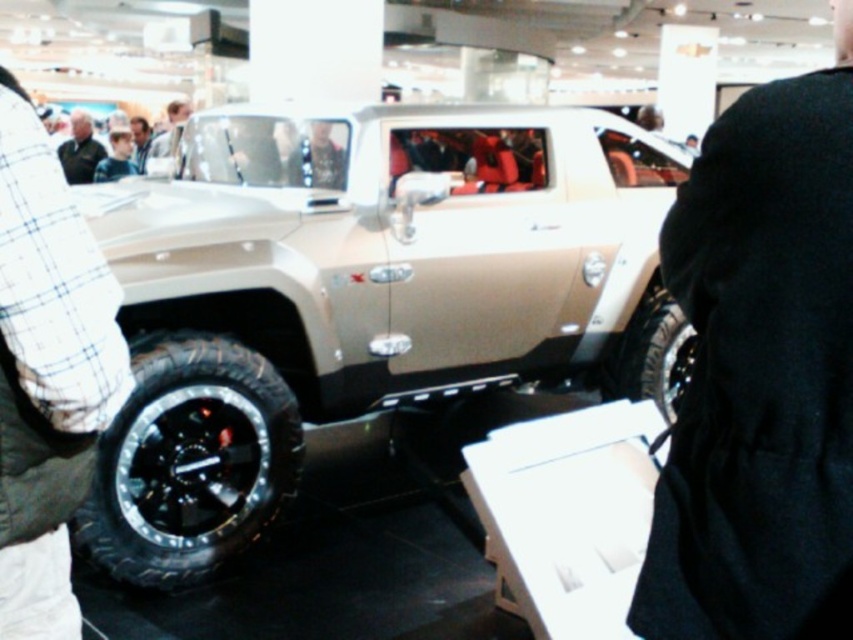
You are standing at the entrance of the car exhibition hall and want to take a photo of the point at coordinate point (123, 470). The camera you have can focus on objects within 10 feet. Will the point be in focus?

The distance of point (123, 470) from the camera is 9.40 feet, which is within the camera focus range of 10 feet. Therefore, the point will be in focus.

You are standing at the entrance of the exhibition hall and want to approach the satin beige vehicle at center. According to the coordinates provided, in which direction should you move from your current position to reach it?

The satin beige vehicle at center is located at point coordinates, so you should move towards the center of the exhibition hall from the entrance to reach it.

You are attending a car show and want to take a photo of the satin beige vehicle at center without including the black rubber tire at lower right in the frame. Which direction should you move your camera to avoid the tire?

The satin beige vehicle at center is to the left of the black rubber tire at lower right. To avoid including the tire in the photo, move your camera to the left side of the vehicle so that the tire is out of frame.